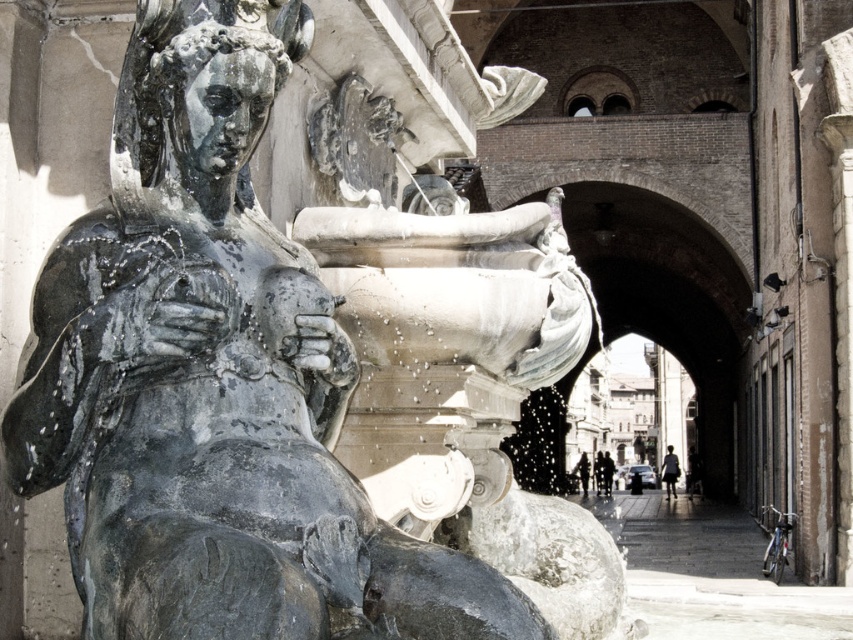
You are standing in front of the fountain and want to take a photo of both the bronze statue at left and the silhouette fabric person at center. Which object should you focus on first to ensure both are in clear view?

You should focus on the bronze statue at left first since it is closer to you than the silhouette fabric person at center, ensuring both are in clear focus when taking the photo.

You are standing in front of the fountain and want to take a photo of both the bronze statue at left and the silhouette fabric person at center. Which object should you adjust your camera angle to focus on first to ensure both are in frame?

The bronze statue at left is above the silhouette fabric person at center, so you should focus on the bronze statue at left first to ensure both are in frame.